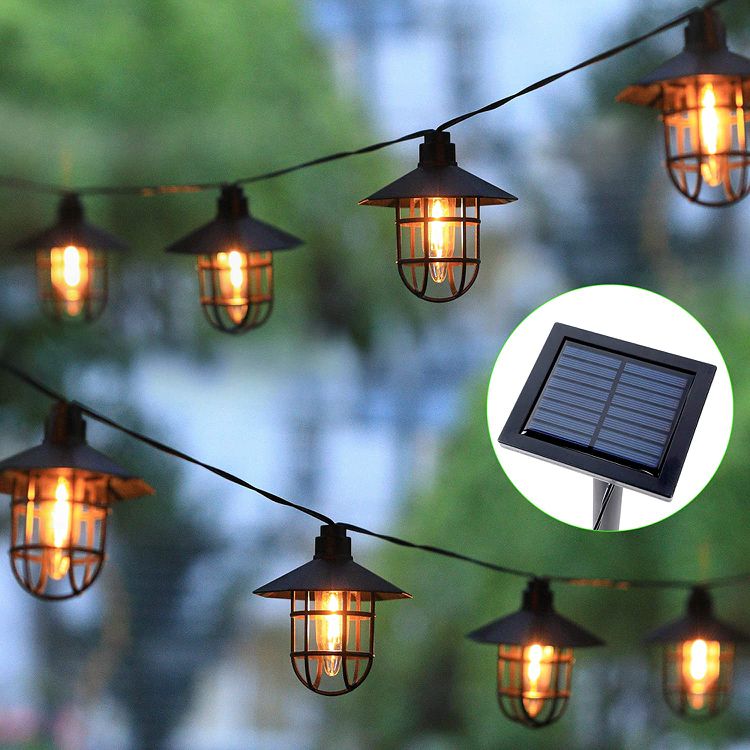
This screenshot has height=750, width=750. Identify the location of black top part of light lantern/lamp. (429, 178).